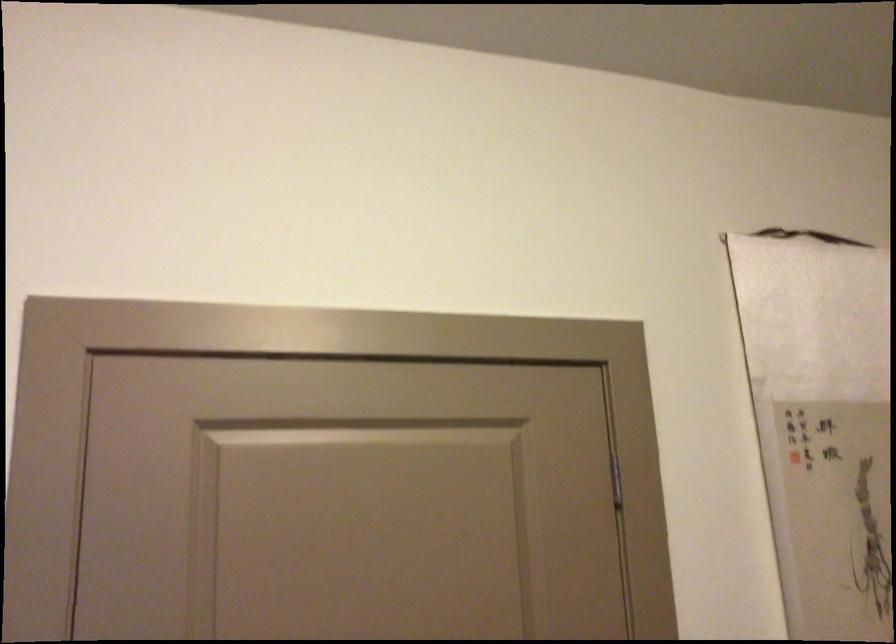
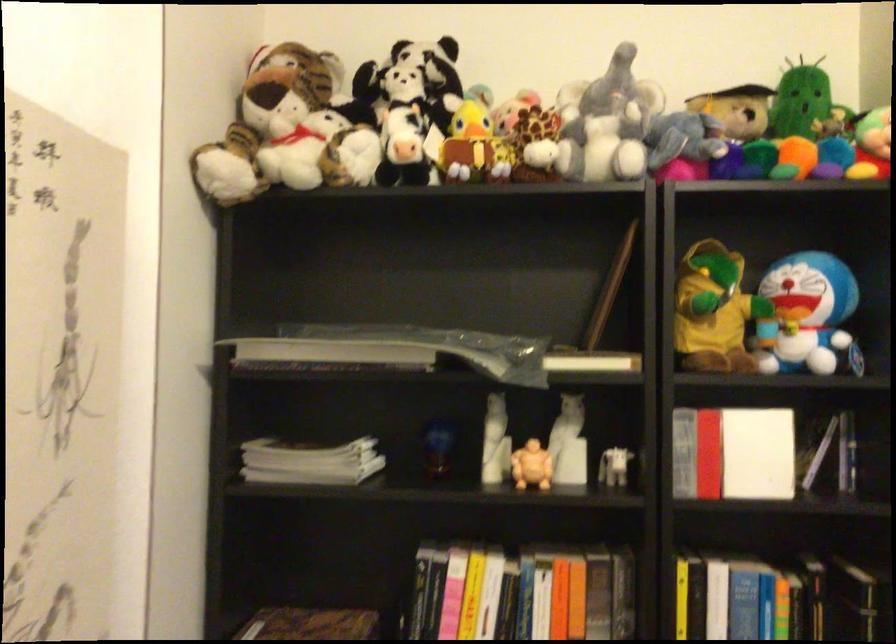
Question: How did the camera likely rotate?

Choices:
 (A) Left
 (B) Right
 (C) Up
 (D) Down

Answer: (B)